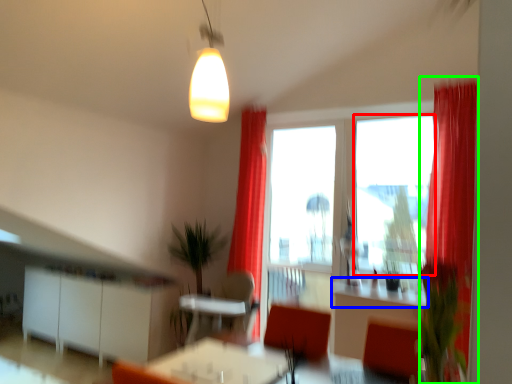
Question: Which object is the farthest from window screen (highlighted by a red box)? Choose among these: counter top (highlighted by a blue box) or curtain (highlighted by a green box).

Choices:
 (A) counter top
 (B) curtain

Answer: (A)